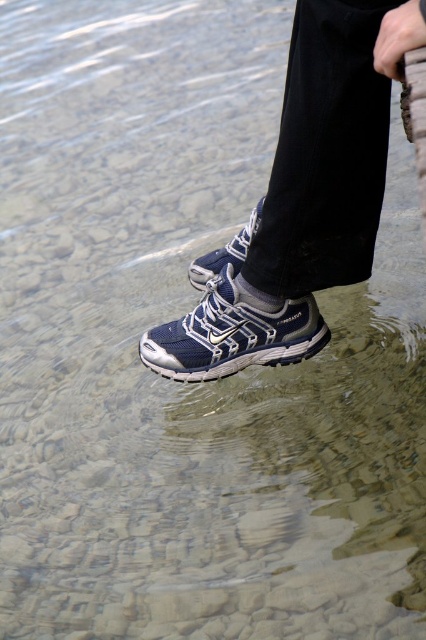
Question: Can you confirm if matte blue mesh shoe at center is positioned to the right of navy mesh shoe at center?

Choices:
 (A) yes
 (B) no

Answer: (A)

Question: Does matte blue mesh shoe at center appear under blue mesh shoe at center?

Choices:
 (A) no
 (B) yes

Answer: (A)

Question: Among these points, which one is nearest to the camera?

Choices:
 (A) pyautogui.click(x=261, y=321)
 (B) pyautogui.click(x=204, y=256)
 (C) pyautogui.click(x=282, y=248)

Answer: (C)

Question: Estimate the real-world distances between objects in this image. Which object is closer to the matte blue mesh shoe at center?

Choices:
 (A) navy mesh shoe at center
 (B) blue mesh shoe at center

Answer: (A)

Question: Is navy mesh shoe at center behind blue mesh shoe at center?

Choices:
 (A) yes
 (B) no

Answer: (B)

Question: Which object is closer to the camera taking this photo?

Choices:
 (A) matte blue mesh shoe at center
 (B) navy mesh shoe at center
 (C) blue mesh shoe at center

Answer: (A)